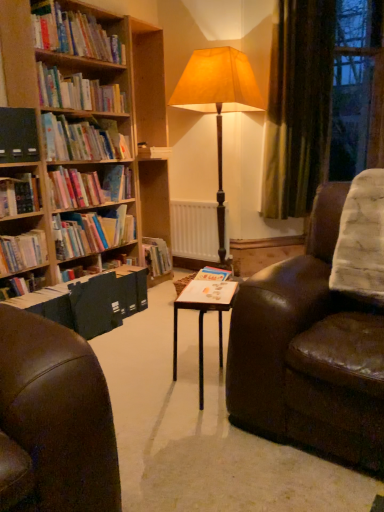
Find the location of a particular element. The height and width of the screenshot is (512, 384). hardcover books at upper left, which is the sixth book from bottom to top is located at coordinates (78, 92).

This screenshot has width=384, height=512. In order to click on matte paper at center, the 2th paperback book viewed from the left in this screenshot , I will do `click(208, 292)`.

What do you see at coordinates (218, 102) in the screenshot? I see `wooden floor lamp at center` at bounding box center [218, 102].

Identify the location of wooden floor lamp at center. The width and height of the screenshot is (384, 512). pyautogui.click(x=218, y=102).

What do you see at coordinates (89, 187) in the screenshot?
I see `hardcover books at left, marked as the fourth book in a bottom-to-top arrangement` at bounding box center [89, 187].

What is the approximate width of hardcover books at left, the 4th book viewed from the top?

hardcover books at left, the 4th book viewed from the top, is 11.26 inches in width.

The image size is (384, 512). What are the coordinates of `hardcover books at upper left, the 2th book from the top` in the screenshot? It's located at click(x=78, y=92).

Is hardcover books at upper left, positioned as the 1th book in top-to-bottom order, far away from matte paper at center, the first paperback book in the front-to-back sequence?

Yes, hardcover books at upper left, positioned as the 1th book in top-to-bottom order, is far from matte paper at center, the first paperback book in the front-to-back sequence.

From the image's perspective, is hardcover books at upper left, which is counted as the 7th book, starting from the bottom, beneath matte paper at center, acting as the second paperback book starting from the back?

No, from the image's perspective, hardcover books at upper left, which is counted as the 7th book, starting from the bottom, is not below matte paper at center, acting as the second paperback book starting from the back.

Between hardcover books at upper left, positioned as the 1th book in top-to-bottom order, and matte paper at center, which is the 2th paperback book from top to bottom, which one appears on the right side from the viewer's perspective?

matte paper at center, which is the 2th paperback book from top to bottom, is more to the right.

Is hardcover books at upper left, which is counted as the 7th book, starting from the bottom, wider than matte paper at center, the 2th paperback book viewed from the left?

No.

From the image's perspective, does hardcover books at upper left, which is the sixth book from bottom to top, appear lower than dark green velvet curtain at upper right?

Indeed, from the image's perspective, hardcover books at upper left, which is the sixth book from bottom to top, is shown beneath dark green velvet curtain at upper right.

Is hardcover books at upper left, which is the sixth book from bottom to top, directly adjacent to dark green velvet curtain at upper right?

No, hardcover books at upper left, which is the sixth book from bottom to top, is not in contact with dark green velvet curtain at upper right.

What's the angular difference between hardcover books at upper left, which is the sixth book from bottom to top, and dark green velvet curtain at upper right's facing directions?

The facing directions of hardcover books at upper left, which is the sixth book from bottom to top, and dark green velvet curtain at upper right are 42.9 degrees apart.

Does hardcover books at upper left, which is the sixth book from bottom to top, have a lesser width compared to dark green velvet curtain at upper right?

In fact, hardcover books at upper left, which is the sixth book from bottom to top, might be wider than dark green velvet curtain at upper right.

Is wooden floor lamp at center closer to the viewer compared to hardcover books at left, marked as the fourth book in a bottom-to-top arrangement?

No.

Is wooden floor lamp at center to the left of hardcover books at left, marked as the fourth book in a bottom-to-top arrangement, from the viewer's perspective?

No, wooden floor lamp at center is not to the left of hardcover books at left, marked as the fourth book in a bottom-to-top arrangement.

Is hardcover books at left, marked as the fourth book in a bottom-to-top arrangement, inside wooden floor lamp at center?

No, hardcover books at left, marked as the fourth book in a bottom-to-top arrangement, is not surrounded by wooden floor lamp at center.

From the picture: From the image's perspective, which one is positioned higher, wooden floor lamp at center or hardcover books at left, marked as the fourth book in a bottom-to-top arrangement?

wooden floor lamp at center, from the image's perspective.

Is white matte radiator at center not close to matte paper at center, the 2th paperback book viewed from the left?

Yes.

Is white matte radiator at center to the left or to the right of matte paper at center, which is the 2th paperback book from top to bottom, in the image?

white matte radiator at center is to the left of matte paper at center, which is the 2th paperback book from top to bottom.

Do you think white matte radiator at center is within matte paper at center, acting as the second paperback book starting from the back, or outside of it?

white matte radiator at center exists outside the volume of matte paper at center, acting as the second paperback book starting from the back.

Does point (31, 206) come in front of point (118, 234)?

Yes, point (31, 206) is in front of point (118, 234).

From a real-world perspective, which book is the 1st one underneath the hardcover book at left, arranged as the fifth book when viewed from the top? Please provide its 2D coordinates.

[(92, 232)]

Considering the positions of objects hardcover book at left, placed as the third book when sorted from bottom to top, and hardcover books at left, the second book positioned from the bottom, in the image provided, who is in front, hardcover book at left, placed as the third book when sorted from bottom to top, or hardcover books at left, the second book positioned from the bottom,?

hardcover book at left, placed as the third book when sorted from bottom to top.

Considering the relative sizes of hardcover books at upper left, positioned as the 1th book in top-to-bottom order, and hardcover books at left, the 6th book in the top-to-bottom sequence, in the image provided, is hardcover books at upper left, positioned as the 1th book in top-to-bottom order, smaller than hardcover books at left, the 6th book in the top-to-bottom sequence,?

Yes.

Is hardcover books at upper left, positioned as the 1th book in top-to-bottom order, taller or shorter than hardcover books at left, the 6th book in the top-to-bottom sequence?

Clearly, hardcover books at upper left, positioned as the 1th book in top-to-bottom order, is taller compared to hardcover books at left, the 6th book in the top-to-bottom sequence.

Based on their positions, is hardcover books at upper left, positioned as the 1th book in top-to-bottom order, located to the left or right of hardcover books at left, the 6th book in the top-to-bottom sequence?

Clearly, hardcover books at upper left, positioned as the 1th book in top-to-bottom order, is on the left of hardcover books at left, the 6th book in the top-to-bottom sequence, in the image.

Choose the correct answer: Is hardcover books at upper left, positioned as the 1th book in top-to-bottom order, inside hardcover books at left, the 6th book in the top-to-bottom sequence, or outside it?

hardcover books at upper left, positioned as the 1th book in top-to-bottom order, exists outside the volume of hardcover books at left, the 6th book in the top-to-bottom sequence.

Is hardcover book at upper left, which ranks as the 5th book in bottom-to-top order, at the right side of hardcover books at upper left, which is the sixth book from bottom to top?

Indeed, hardcover book at upper left, which ranks as the 5th book in bottom-to-top order, is positioned on the right side of hardcover books at upper left, which is the sixth book from bottom to top.

Consider the image. Considering the sizes of objects hardcover book at upper left, placed as the third book when sorted from top to bottom, and hardcover books at upper left, which is the sixth book from bottom to top, in the image provided, who is shorter, hardcover book at upper left, placed as the third book when sorted from top to bottom, or hardcover books at upper left, which is the sixth book from bottom to top,?

hardcover books at upper left, which is the sixth book from bottom to top, is shorter.

Is hardcover book at upper left, which ranks as the 5th book in bottom-to-top order, not inside hardcover books at upper left, which is the sixth book from bottom to top?

Absolutely, hardcover book at upper left, which ranks as the 5th book in bottom-to-top order, is external to hardcover books at upper left, which is the sixth book from bottom to top.

The height and width of the screenshot is (512, 384). Find the location of `the 2nd paperback book in front of the hardcover books at upper left, which is counted as the 7th book, starting from the bottom`. the 2nd paperback book in front of the hardcover books at upper left, which is counted as the 7th book, starting from the bottom is located at coordinates (208, 292).

From a real-world perspective, starting from the dark green velvet curtain at upper right, which book is the 1st one vertically above it? Please provide its 2D coordinates.

[(78, 92)]

Looking at this image, from the image, which object appears to be nearer to white matte radiator at center, hardcover books at left, marked as the fourth book in a bottom-to-top arrangement, or dark green velvet curtain at upper right?

Based on the image, dark green velvet curtain at upper right appears to be nearer to white matte radiator at center.

Considering their positions, is hardcover books at left, the second book positioned from the bottom, positioned further to transparent glass window at upper right than hardcover book at upper left, which ranks as the 5th book in bottom-to-top order?

Among the two, hardcover books at left, the second book positioned from the bottom, is located further to transparent glass window at upper right.

Looking at the image, which one is located closer to white wooden table at center, matte paper at center, which is the 2th paperback book from top to bottom, or hardcover book at upper left, which ranks as the 5th book in bottom-to-top order?

matte paper at center, which is the 2th paperback book from top to bottom, lies closer to white wooden table at center than the other object.

Which object lies further to the anchor point hardcover books at left, the 4th book viewed from the top, transparent glass window at upper right or black matte book at left, arranged as the 2th paperback book when viewed from the front?

transparent glass window at upper right is positioned further to the anchor hardcover books at left, the 4th book viewed from the top.

Considering their positions, is hardcover books at upper left, which is the sixth book from bottom to top, positioned further to dark green velvet curtain at upper right than hardcover book at upper left, placed as the third book when sorted from top to bottom?

hardcover book at upper left, placed as the third book when sorted from top to bottom, is positioned further to the anchor dark green velvet curtain at upper right.

Based on their spatial positions, is white wooden table at center or matte paper at center, which appears as the first paperback book when ordered from the bottom, further from white matte radiator at center?

matte paper at center, which appears as the first paperback book when ordered from the bottom, lies further to white matte radiator at center than the other object.

Based on the photo, estimate the real-world distances between objects in this image. Which object is closer to white matte radiator at center, transparent glass window at upper right or hardcover books at upper left, which is counted as the 7th book, starting from the bottom?

transparent glass window at upper right lies closer to white matte radiator at center than the other object.

Looking at the image, which one is located further to hardcover book at upper left, which ranks as the 5th book in bottom-to-top order, hardcover book at left, arranged as the fifth book when viewed from the top, or hardcover books at upper left, which is counted as the 7th book, starting from the bottom?

The object further to hardcover book at upper left, which ranks as the 5th book in bottom-to-top order, is hardcover books at upper left, which is counted as the 7th book, starting from the bottom.

The width and height of the screenshot is (384, 512). What are the coordinates of `paperback book between black matte book at left, which ranks as the second paperback book in bottom-to-top order, and transparent glass window at upper right from left to right` in the screenshot? It's located at (208, 292).

Where is `paperback book between hardcover book at upper left, placed as the third book when sorted from top to bottom, and dark green velvet curtain at upper right from left to right`? The image size is (384, 512). paperback book between hardcover book at upper left, placed as the third book when sorted from top to bottom, and dark green velvet curtain at upper right from left to right is located at coordinates (208, 292).

Locate an element on the screen. The image size is (384, 512). paperback book between hardcover books at upper left, which is counted as the 7th book, starting from the bottom, and hardcover books at left, the 4th book viewed from the top, vertically is located at coordinates (18, 135).

You are a GUI agent. You are given a task and a screenshot of the screen. Output one action in this format:
    pyautogui.click(x=<x>, y=<y>)
    Task: Click on the curtain between transparent glass window at upper right and white wooden table at center in the vertical direction
    
    Given the screenshot: What is the action you would take?
    pyautogui.click(x=298, y=106)